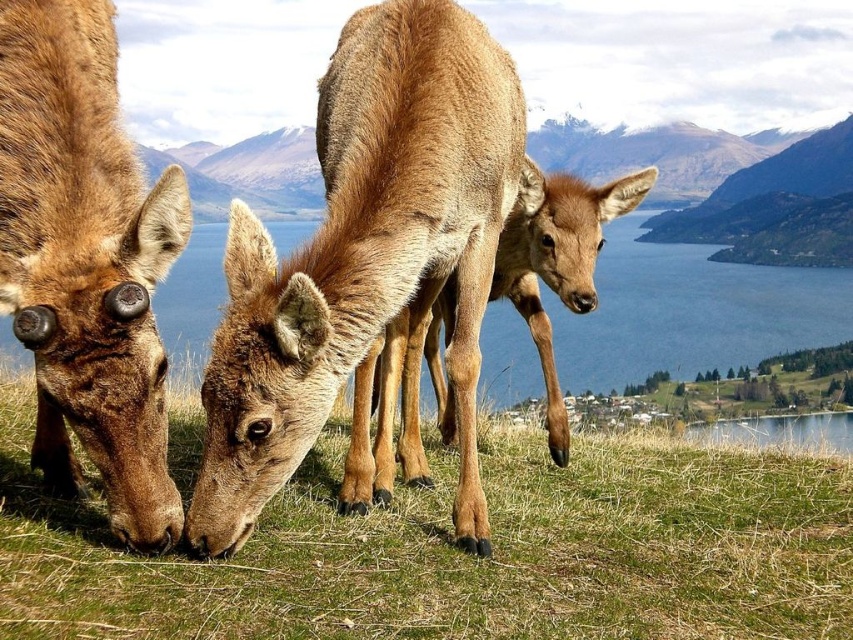
Question: Which of the following is the farthest from the observer?

Choices:
 (A) (635, 291)
 (B) (198, 616)
 (C) (225, 444)
 (D) (55, 433)

Answer: (A)

Question: Is green grass at center wider than brown matte fur at lower left?

Choices:
 (A) no
 (B) yes

Answer: (B)

Question: Does green grass at center appear over clear blue water at center?

Choices:
 (A) no
 (B) yes

Answer: (A)

Question: Which of the following is the farthest from the observer?

Choices:
 (A) brown matte fur at lower left
 (B) green grass at center
 (C) clear blue water at center
 (D) brown fur deer at center

Answer: (C)

Question: Is green grass at center to the left of brown matte fur at lower left from the viewer's perspective?

Choices:
 (A) no
 (B) yes

Answer: (A)

Question: Among these points, which one is farthest from the camera?

Choices:
 (A) (53, 72)
 (B) (515, 88)
 (C) (173, 576)

Answer: (B)